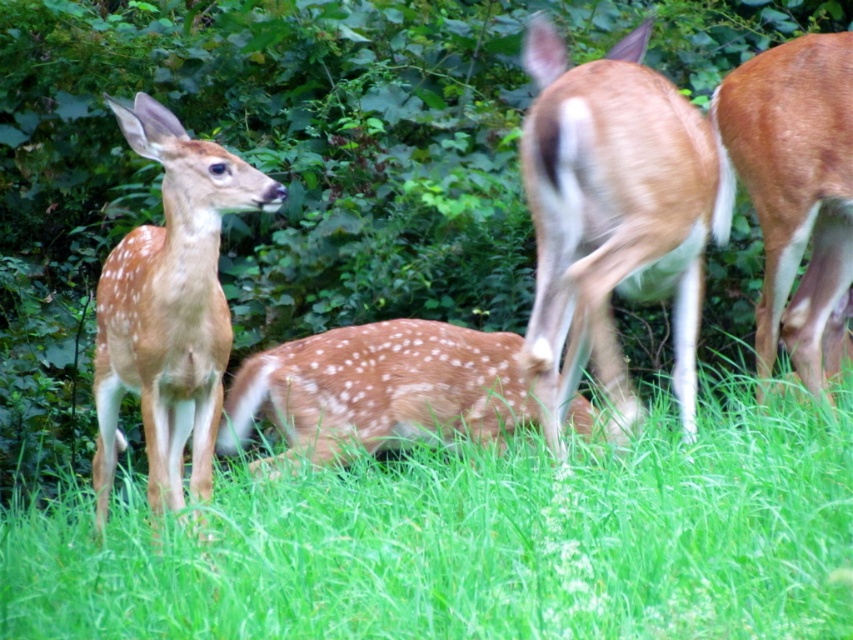
Can you confirm if green grassy at lower center is shorter than brown speckled fur at center?

Correct, green grassy at lower center is not as tall as brown speckled fur at center.

Who is more forward, (x=448, y=490) or (x=555, y=260)?

Point (x=448, y=490) is more forward.

Who is more forward, (659, 480) or (619, 49)?

Point (659, 480) is more forward.

Where is `green grassy at lower center`? green grassy at lower center is located at coordinates (476, 540).

Can you confirm if brown speckled fur at center is thinner than brown matte fur at right?

Indeed, brown speckled fur at center has a lesser width compared to brown matte fur at right.

Is brown speckled fur at center below brown matte fur at right?

Correct, brown speckled fur at center is located below brown matte fur at right.

Does point (613, 99) lie in front of point (825, 196)?

Yes, it is in front of point (825, 196).

Where is `brown speckled fur at center`? The image size is (853, 640). brown speckled fur at center is located at coordinates (611, 218).

Does green grassy at lower center appear on the right side of brown matte fur at right?

No, green grassy at lower center is not to the right of brown matte fur at right.

Can you confirm if green grassy at lower center is positioned below brown matte fur at right?

Yes, green grassy at lower center is below brown matte fur at right.

Measure the distance between point (x=115, y=554) and camera.

10.07 feet

Find the location of `green grassy at lower center`. green grassy at lower center is located at coordinates (476, 540).